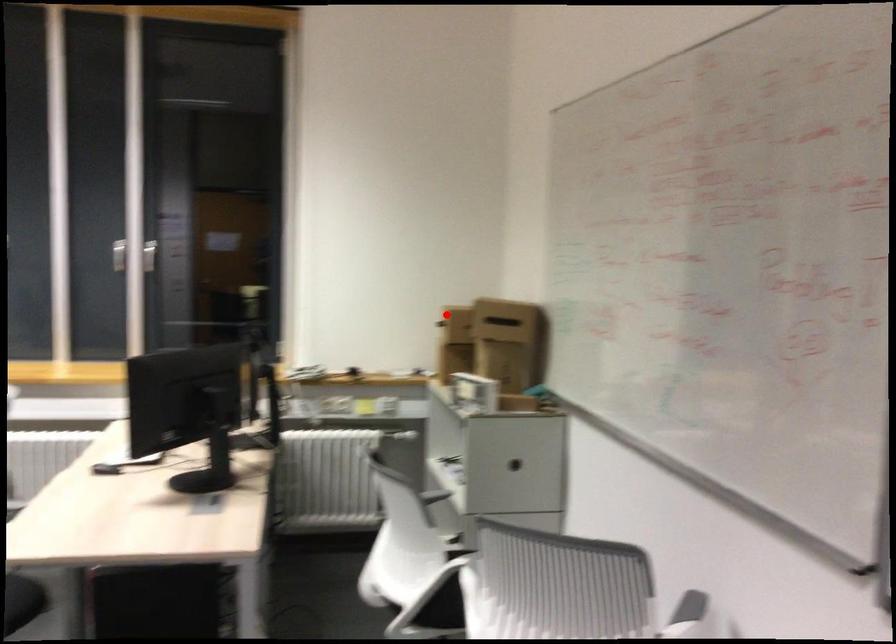
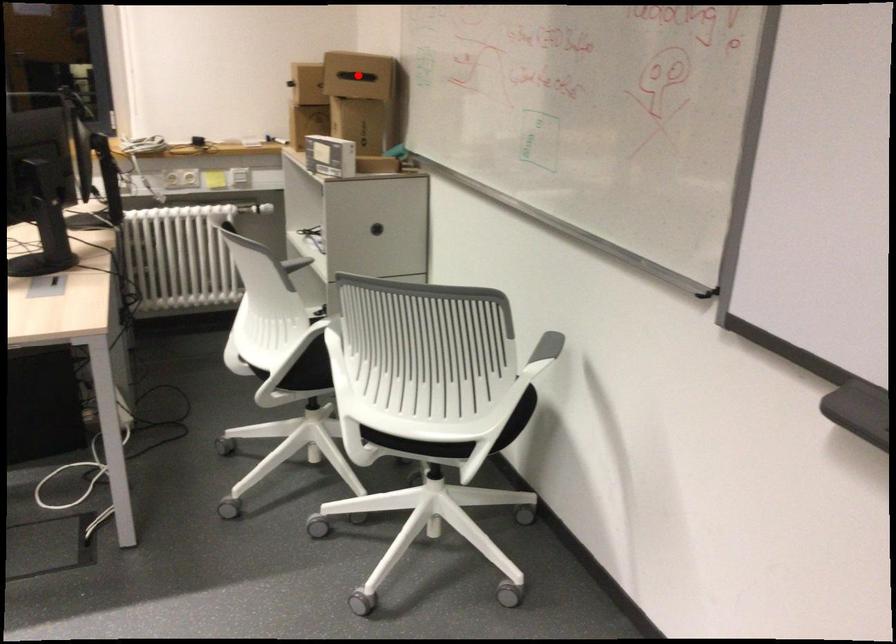
I am providing you with two images of the same scene from different viewpoints. A red point is marked on the first image and another point is marked on the second image. Is the marked point in image1 the same physical position as the marked point in image2?

No